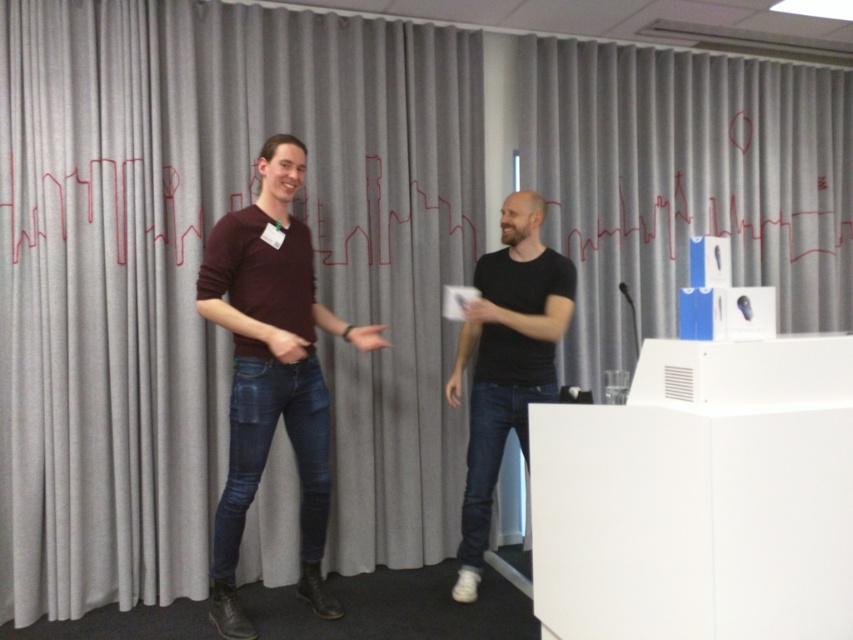
Question: Does gray fabric curtain at upper center have a greater width compared to maroon sweater at center?

Choices:
 (A) yes
 (B) no

Answer: (A)

Question: Estimate the real-world distances between objects in this image. Which object is closer to the matte black lines at upper left?

Choices:
 (A) gray fabric curtain at upper center
 (B) white matte wii controller at center
 (C) gray fabric curtain at center
 (D) black matte shirt at right

Answer: (C)

Question: Estimate the real-world distances between objects in this image. Which object is closer to the gray fabric curtain at center?

Choices:
 (A) white matte wii controller at center
 (B) matte black lines at upper left
 (C) maroon sweater at center
 (D) black matte shirt at right

Answer: (B)

Question: Which point is closer to the camera taking this photo?

Choices:
 (A) (550, 284)
 (B) (238, 369)
 (C) (453, 308)

Answer: (B)

Question: Does gray fabric curtain at center have a greater width compared to white matte wii controller at center?

Choices:
 (A) no
 (B) yes

Answer: (B)

Question: Can you confirm if gray fabric curtain at center is thinner than black matte shirt at right?

Choices:
 (A) no
 (B) yes

Answer: (A)